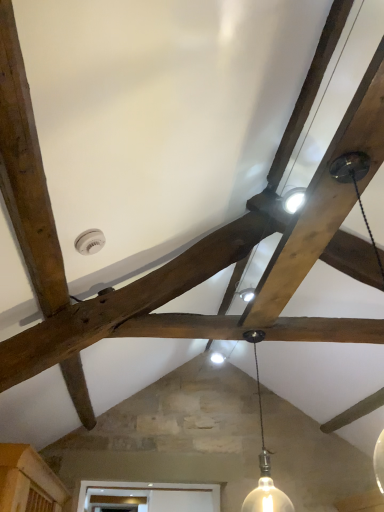
Question: Should I look upward or downward to see matte white bulb at center?

Choices:
 (A) down
 (B) up

Answer: (A)